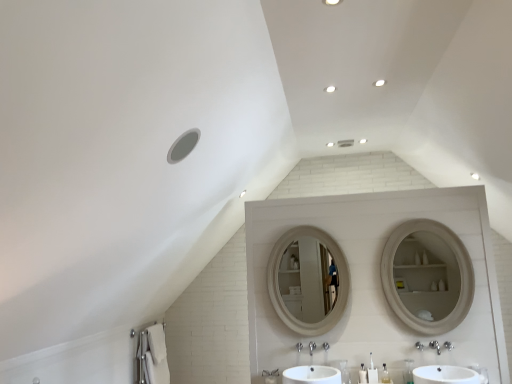
Question: Is white glossy sink at center, which is the second sink in right-to-left order, shorter than white plastic toothbrush at lower center, placed as the fourth toiletry when sorted from right to left?

Choices:
 (A) no
 (B) yes

Answer: (B)

Question: Considering the relative sizes of white glossy sink at center, which ranks as the 1th sink in left-to-right order, and white plastic toothbrush at lower center, which appears as the first toiletry when viewed from the left, in the image provided, is white glossy sink at center, which ranks as the 1th sink in left-to-right order, thinner than white plastic toothbrush at lower center, which appears as the first toiletry when viewed from the left,?

Choices:
 (A) yes
 (B) no

Answer: (B)

Question: Is white glossy sink at center, which is the second sink in right-to-left order, not within white plastic toothbrush at lower center, which appears as the first toiletry when viewed from the left?

Choices:
 (A) yes
 (B) no

Answer: (A)

Question: Is white glossy sink at center, which ranks as the 1th sink in left-to-right order, next to white plastic toothbrush at lower center, which appears as the first toiletry when viewed from the left?

Choices:
 (A) no
 (B) yes

Answer: (A)

Question: Is there a large distance between white glossy sink at center, which is the second sink in right-to-left order, and white plastic toothbrush at lower center, which appears as the first toiletry when viewed from the left?

Choices:
 (A) no
 (B) yes

Answer: (A)

Question: Considering the positions of point (387, 370) and point (338, 372), is point (387, 370) closer or farther from the camera than point (338, 372)?

Choices:
 (A) closer
 (B) farther

Answer: (A)

Question: From the image's perspective, is clear plastic bottle at center, which ranks as the second toiletry in right-to-left order, positioned above or below white glossy sink at center, which ranks as the 1th sink in left-to-right order?

Choices:
 (A) above
 (B) below

Answer: (B)

Question: Considering the relative positions of clear plastic bottle at center, marked as the 3th toiletry in a left-to-right arrangement, and white glossy sink at center, which is the second sink in right-to-left order, in the image provided, is clear plastic bottle at center, marked as the 3th toiletry in a left-to-right arrangement, to the left or to the right of white glossy sink at center, which is the second sink in right-to-left order,?

Choices:
 (A) right
 (B) left

Answer: (A)

Question: Considering the positions of clear plastic bottle at center, which ranks as the second toiletry in right-to-left order, and white glossy sink at center, which ranks as the 1th sink in left-to-right order, in the image, is clear plastic bottle at center, which ranks as the second toiletry in right-to-left order, taller or shorter than white glossy sink at center, which ranks as the 1th sink in left-to-right order,?

Choices:
 (A) short
 (B) tall

Answer: (B)

Question: From the image's perspective, relative to clear plastic bottle at center, which ranks as the second toiletry in right-to-left order, is clear plastic bottle at center, the fourth toiletry from the left, above or below?

Choices:
 (A) above
 (B) below

Answer: (A)

Question: Looking at their shapes, would you say clear plastic bottle at center, the fourth toiletry from the left, is wider or thinner than clear plastic bottle at center, marked as the 3th toiletry in a left-to-right arrangement?

Choices:
 (A) wide
 (B) thin

Answer: (A)

Question: Looking at the image, does clear plastic bottle at center, the fourth toiletry from the left, seem bigger or smaller compared to clear plastic bottle at center, marked as the 3th toiletry in a left-to-right arrangement?

Choices:
 (A) big
 (B) small

Answer: (A)

Question: From a real-world perspective, is clear plastic bottle at center, marked as the 1th toiletry in a right-to-left arrangement, positioned above or below clear plastic bottle at center, marked as the 3th toiletry in a left-to-right arrangement?

Choices:
 (A) below
 (B) above

Answer: (B)

Question: Does point (312, 321) appear closer or farther from the camera than point (359, 375)?

Choices:
 (A) farther
 (B) closer

Answer: (A)

Question: Is white wooden mirror at center to the left or to the right of white plastic pump at center, the third toiletry when ordered from right to left, in the image?

Choices:
 (A) left
 (B) right

Answer: (A)